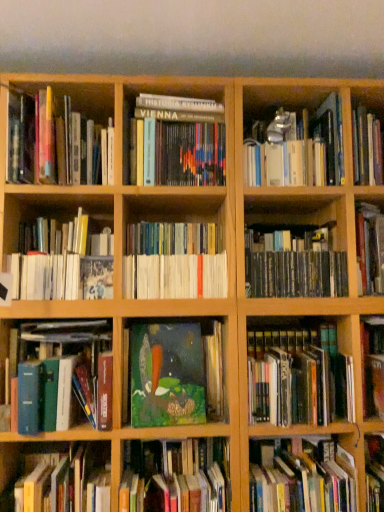
Question: Can you confirm if green matte book at center, the tenth book viewed from the top, is shorter than hardcover book at upper right, which is the twelfth book in bottom-to-top order?

Choices:
 (A) no
 (B) yes

Answer: (B)

Question: Is green matte book at center, the 3th book when ordered from bottom to top, outside of hardcover book at upper right, which is the twelfth book in bottom-to-top order?

Choices:
 (A) yes
 (B) no

Answer: (A)

Question: Is green matte book at center, the 3th book when ordered from bottom to top, beside hardcover book at upper right, which is the twelfth book in bottom-to-top order?

Choices:
 (A) no
 (B) yes

Answer: (A)

Question: Considering the relative sizes of green matte book at center, the tenth book viewed from the top, and hardcover book at upper right, the first book from the top, in the image provided, is green matte book at center, the tenth book viewed from the top, taller than hardcover book at upper right, the first book from the top,?

Choices:
 (A) yes
 (B) no

Answer: (B)

Question: Is green matte book at center, the 3th book when ordered from bottom to top, aimed at hardcover book at upper right, which is the twelfth book in bottom-to-top order?

Choices:
 (A) no
 (B) yes

Answer: (A)

Question: Is green matte painting at center, the fifth book in the bottom-to-top sequence, in front of or behind hardcover book at lower left, the second book ordered from the bottom, in the image?

Choices:
 (A) front
 (B) behind

Answer: (B)

Question: Based on their positions, is green matte painting at center, the fifth book in the bottom-to-top sequence, located to the left or right of hardcover book at lower left, positioned as the eleventh book in top-to-bottom order?

Choices:
 (A) right
 (B) left

Answer: (A)

Question: Considering the positions of green matte painting at center, the 8th book from the top, and hardcover book at lower left, positioned as the eleventh book in top-to-bottom order, in the image, is green matte painting at center, the 8th book from the top, bigger or smaller than hardcover book at lower left, positioned as the eleventh book in top-to-bottom order,?

Choices:
 (A) small
 (B) big

Answer: (A)

Question: Do you think green matte painting at center, the fifth book in the bottom-to-top sequence, is within hardcover book at lower left, the second book ordered from the bottom, or outside of it?

Choices:
 (A) outside
 (B) inside

Answer: (A)

Question: Is green matte painting at center, the fifth book in the bottom-to-top sequence, bigger or smaller than hardcover book at upper right, the first book from the top?

Choices:
 (A) small
 (B) big

Answer: (A)

Question: In the image, is green matte painting at center, the fifth book in the bottom-to-top sequence, positioned in front of or behind hardcover book at upper right, which is the twelfth book in bottom-to-top order?

Choices:
 (A) front
 (B) behind

Answer: (B)

Question: Considering the relative positions of green matte painting at center, the fifth book in the bottom-to-top sequence, and hardcover book at upper right, the first book from the top, in the image provided, is green matte painting at center, the fifth book in the bottom-to-top sequence, to the left or to the right of hardcover book at upper right, the first book from the top,?

Choices:
 (A) left
 (B) right

Answer: (A)

Question: Is point (196, 370) positioned closer to the camera than point (329, 150)?

Choices:
 (A) closer
 (B) farther

Answer: (A)

Question: Is point (163, 286) closer or farther from the camera than point (340, 162)?

Choices:
 (A) closer
 (B) farther

Answer: (A)

Question: Is white paperbacks at center, arranged as the 5th book when viewed from the top, inside the boundaries of hardcover book at upper right, which is the twelfth book in bottom-to-top order, or outside?

Choices:
 (A) inside
 (B) outside

Answer: (B)